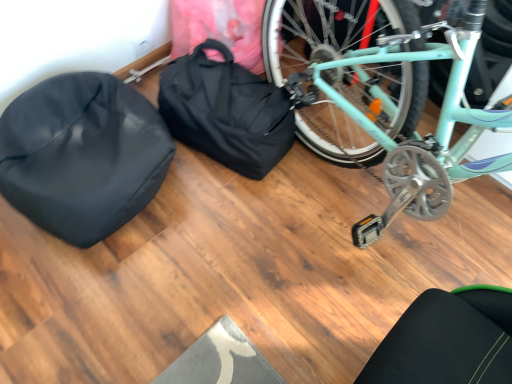
You are a GUI agent. You are given a task and a screenshot of the screen. Output one action in this format:
    pyautogui.click(x=<x>, y=<y>)
    Task: Click on the vacant area that lies to the right of black matte sleeping bag at left
    Image resolution: width=512 pixels, height=384 pixels.
    Given the screenshot: What is the action you would take?
    pyautogui.click(x=244, y=222)